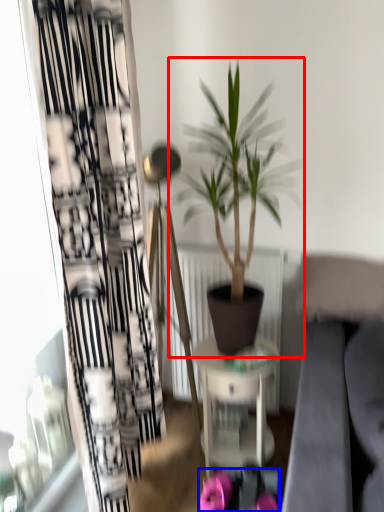
Question: Among these objects, which one is nearest to the camera, houseplant (highlighted by a red box) or flower (highlighted by a blue box)?

Choices:
 (A) houseplant
 (B) flower

Answer: (A)